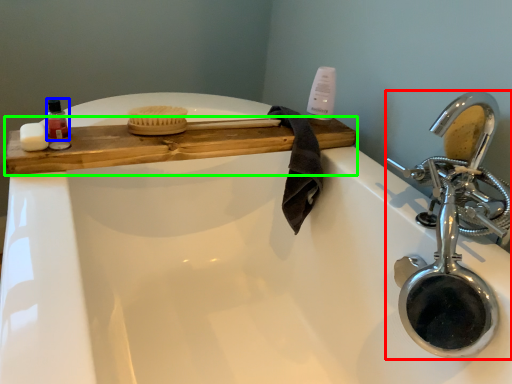
Question: Considering the real-world distances, which object is farthest from tap (highlighted by a red box)? mouthwash (highlighted by a blue box) or counter (highlighted by a green box)?

Choices:
 (A) mouthwash
 (B) counter

Answer: (A)